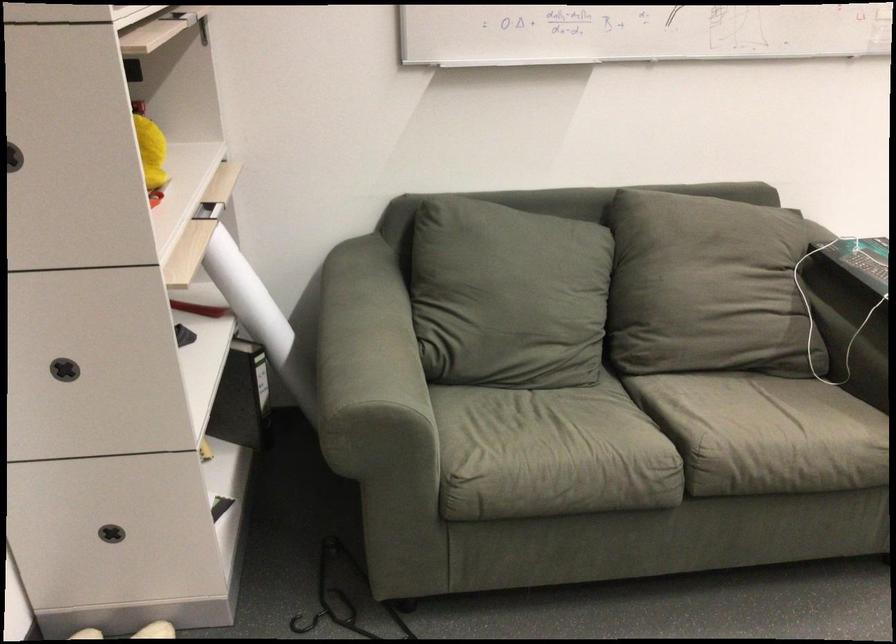
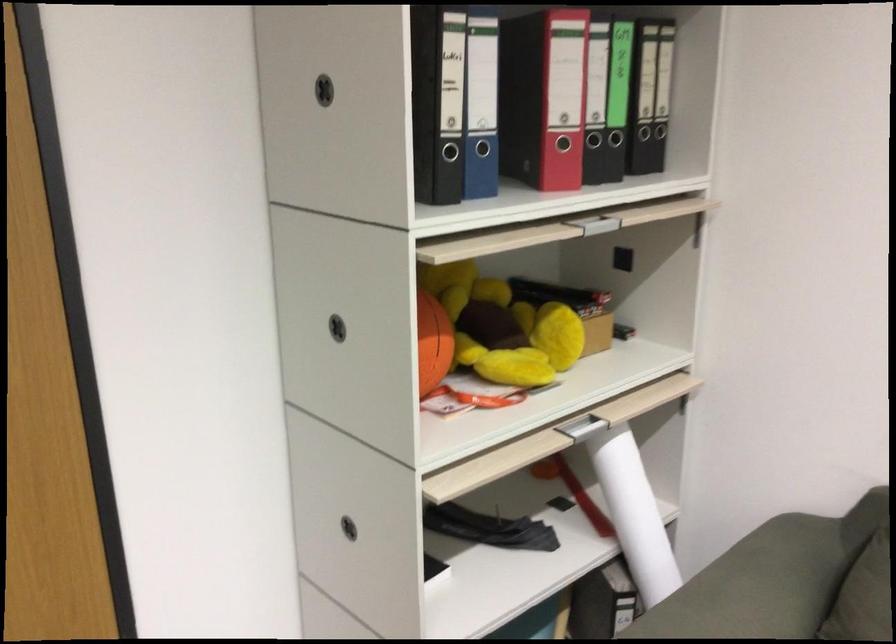
Question: The camera is either moving clockwise (left) or counter-clockwise (right) around the object. The first image is from the beginning of the video and the second image is from the end. Is the camera moving left or right when shooting the video?

Choices:
 (A) Left
 (B) Right

Answer: (B)